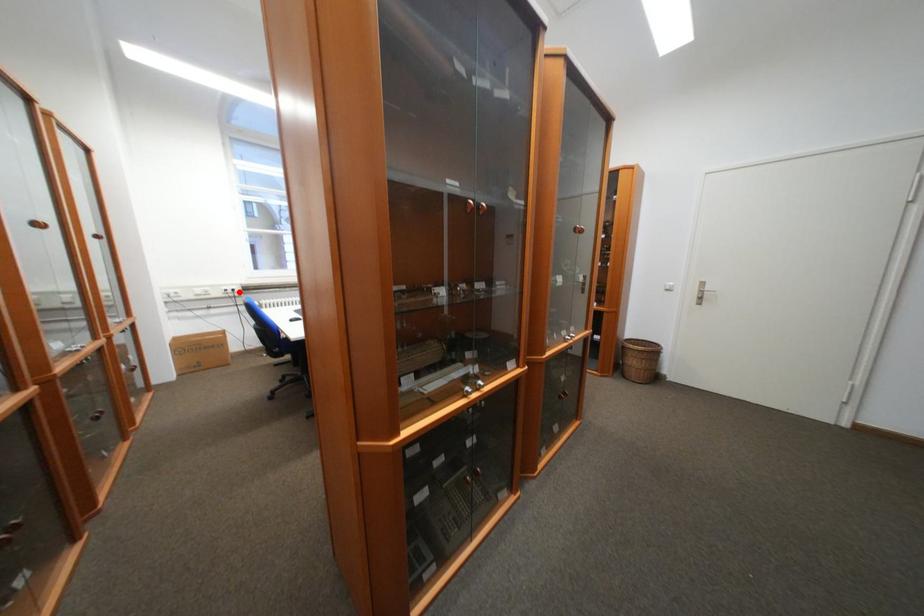
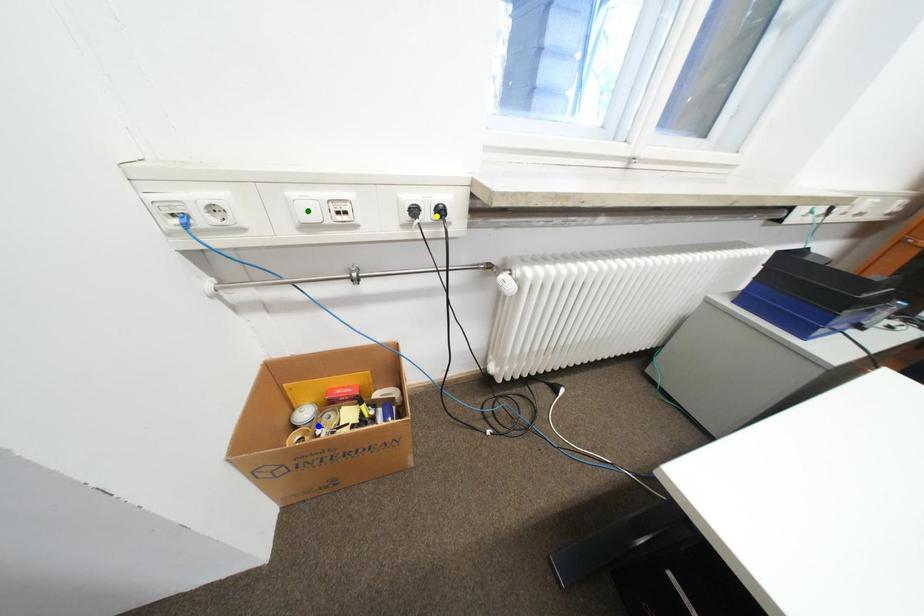
Question: I am providing you with two images of the same scene from different viewpoints. A red point is marked on the first image. You are given multiple points on the second image. Which spot in image 2 lines up with the point in image 1?

Choices:
 (A) yellow point
 (B) green point
 (C) blue point

Answer: (A)